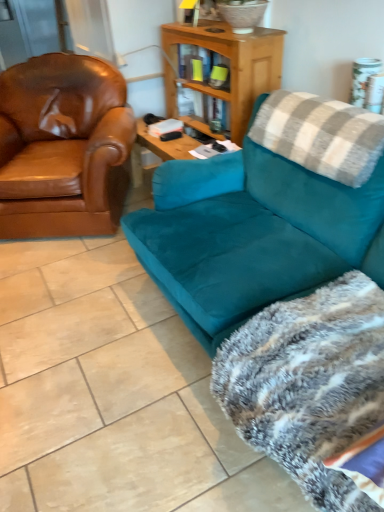
Question: Is brown leather armchair at left in front of or behind teal suede couch at right in the image?

Choices:
 (A) behind
 (B) front

Answer: (A)

Question: Considering the positions of brown leather armchair at left and teal suede couch at right in the image, is brown leather armchair at left bigger or smaller than teal suede couch at right?

Choices:
 (A) big
 (B) small

Answer: (B)

Question: Based on their relative distances, which object is nearer to the fluffy gray blanket at lower right?

Choices:
 (A) brown leather armchair at left
 (B) gray plaid pillow at upper right
 (C) teal suede couch at right

Answer: (C)

Question: Which is nearer to the brown leather armchair at left?

Choices:
 (A) gray plaid pillow at upper right
 (B) fluffy gray blanket at lower right
 (C) teal suede couch at right

Answer: (C)